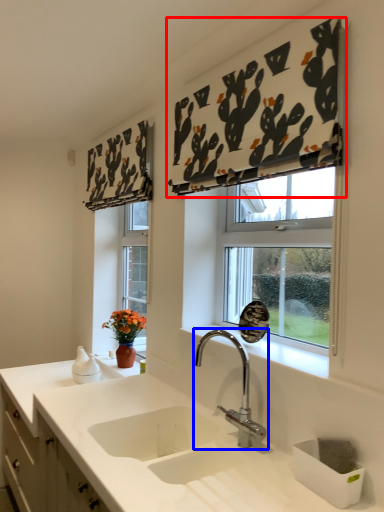
Question: Which object is closer to the camera taking this photo, curtain (highlighted by a red box) or tap (highlighted by a blue box)?

Choices:
 (A) curtain
 (B) tap

Answer: (A)